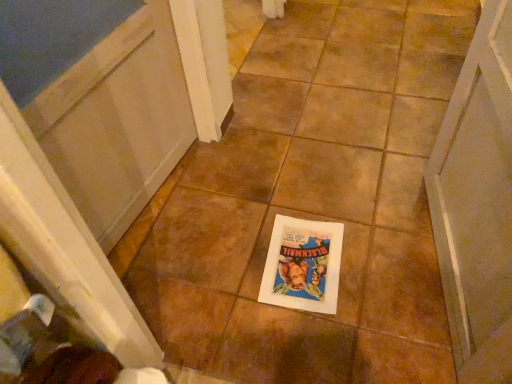
At what (x,y) coordinates should I click in order to perform the action: click on vacant space in matte paper book at center (from a real-world perspective). Please return your answer as a coordinate pair (x, y). This screenshot has width=512, height=384. Looking at the image, I should click on (303, 265).